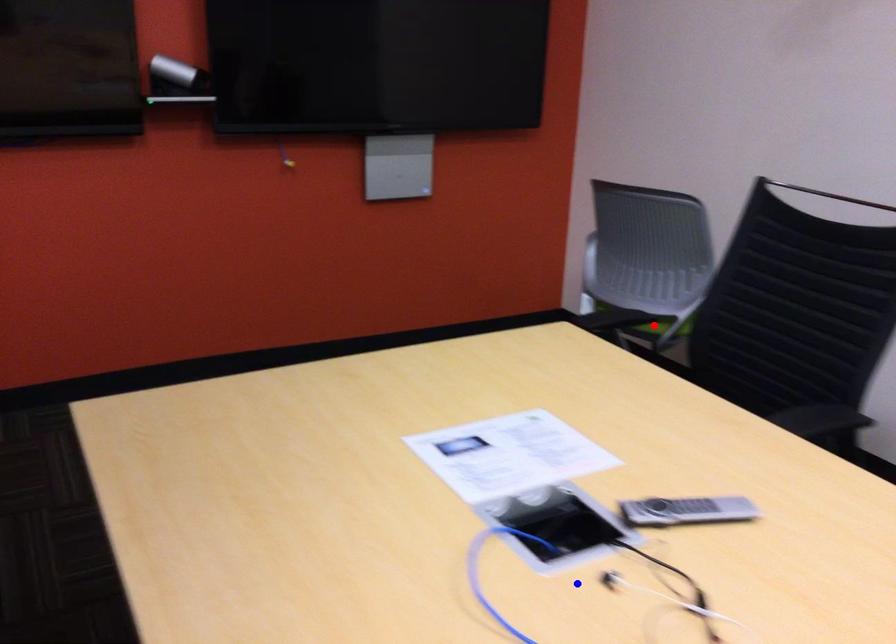
Question: In the image, two points are highlighted. Which point is nearer to the camera? Reply with the corresponding letter.

Choices:
 (A) blue point
 (B) red point

Answer: (A)